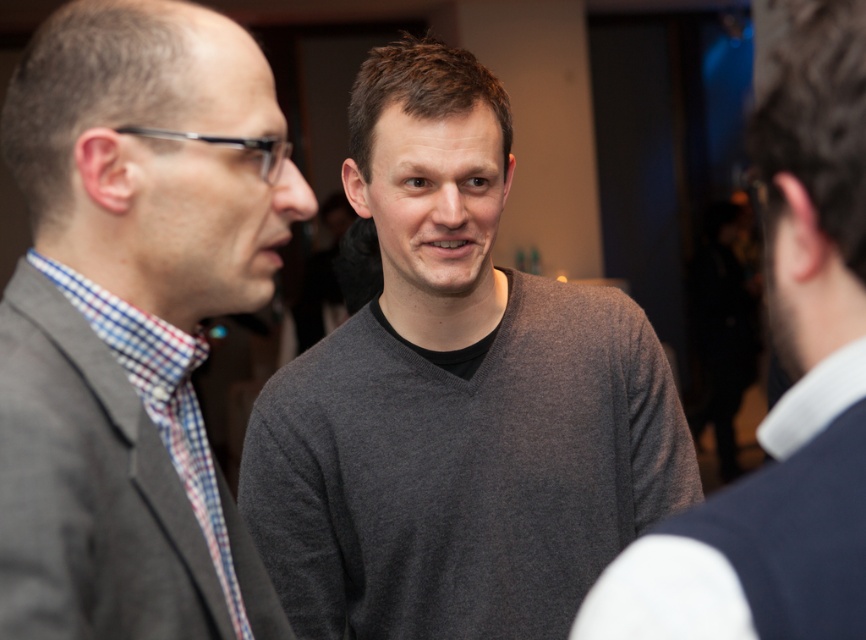
You are standing in the room and see two points marked in the image. Which point is closer to you, point (595, 468) or point (724, 518)?

Point (595, 468) is closer to you because it is further to the viewer than point (724, 518).

You are trying to decide which sweater to wear for an event. You see the matte gray sweater at center and the dark gray sweater at center in the image. Which one has a wider appearance?

The matte gray sweater at center is wider than the dark gray sweater at center according to the description.

You are a photographer standing in the scene. You want to take a photo of both the gray matte sweater at center and the matte gray sweater at center. Since they are the same color, how far apart are they from each other to ensure they are both in focus?

The gray matte sweater at center and the matte gray sweater at center are 25.92 inches apart. To ensure both are in focus, the photographer should adjust the camera settings to account for the 25.92 inches distance between them.